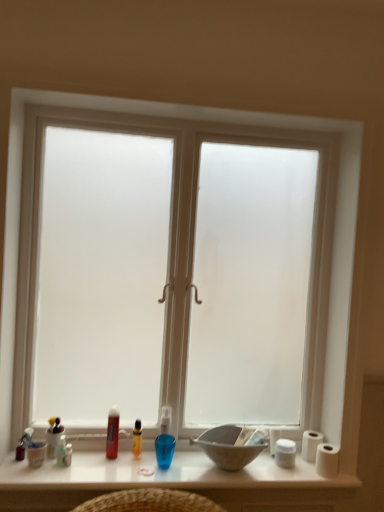
Image resolution: width=384 pixels, height=512 pixels. What are the coordinates of `blank area to the left of translucent plastic bottle at center, arranged as the 1th toiletry when viewed from the right` in the screenshot? It's located at (95, 461).